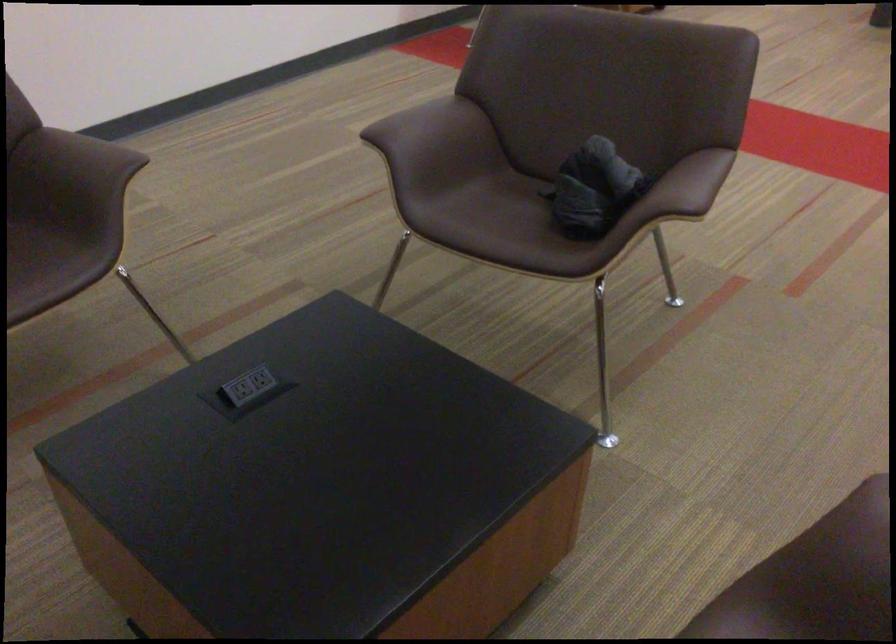
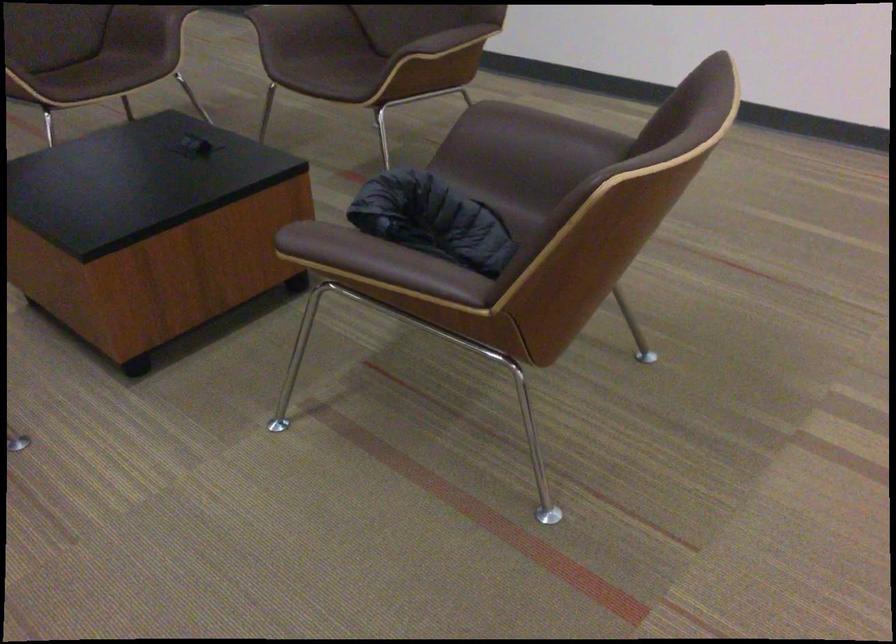
Locate, in the second image, the point that corresponds to point (127, 162) in the first image.

(444, 46)